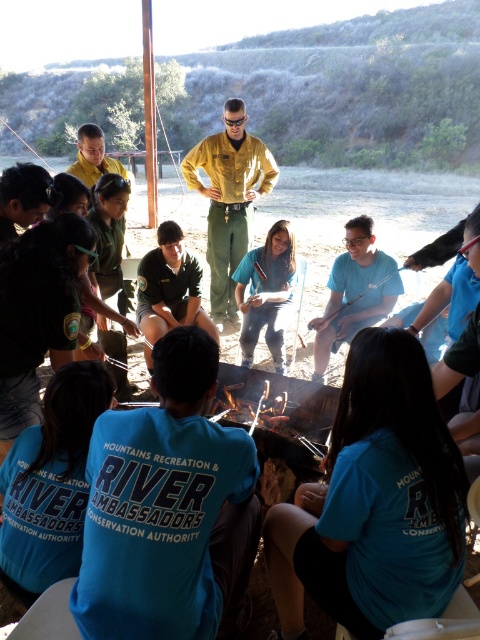
Question: Which object is the closest to the blue cotton shirt at center?

Choices:
 (A) blue t-shirt at center
 (B) green uniform at center

Answer: (B)

Question: Is yellow uniform at center below blue t-shirt at center?

Choices:
 (A) yes
 (B) no

Answer: (B)

Question: Which point is closer to the camera?

Choices:
 (A) matte blue shirt at center
 (B) blue cotton shirt at center
 (C) blue fabric shirt at center
 (D) yellow uniform at center

Answer: (B)

Question: Does yellow uniform at center appear under blue t-shirt at center?

Choices:
 (A) no
 (B) yes

Answer: (A)

Question: Based on their relative distances, which object is farther from the yellow uniform at center?

Choices:
 (A) blue fabric shirt at center
 (B) charcoal wood fire at center
 (C) matte blue shirt at center
 (D) green uniform at center

Answer: (C)

Question: Observing the image, what is the correct spatial positioning of blue cotton shirt at center in reference to blue t-shirt at center?

Choices:
 (A) below
 (B) above

Answer: (A)